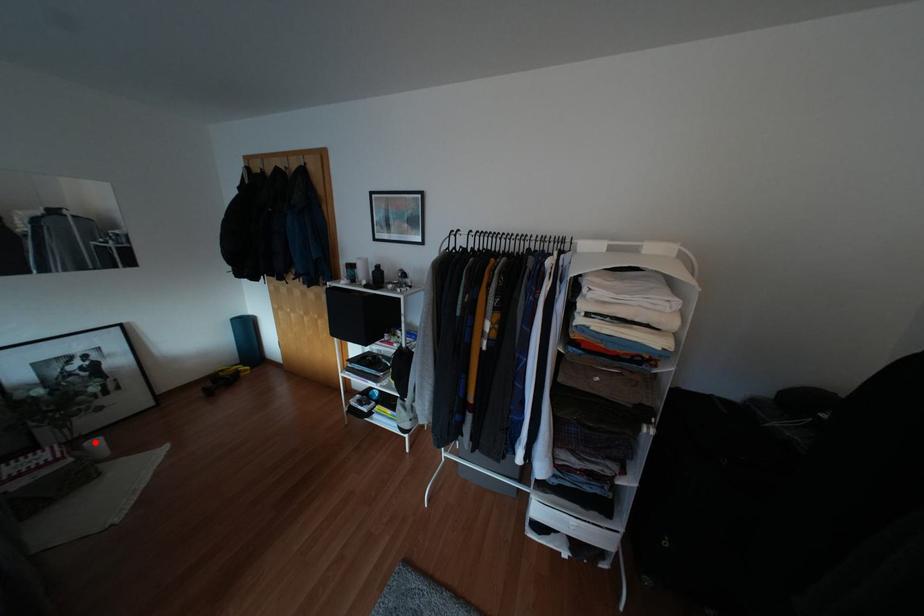
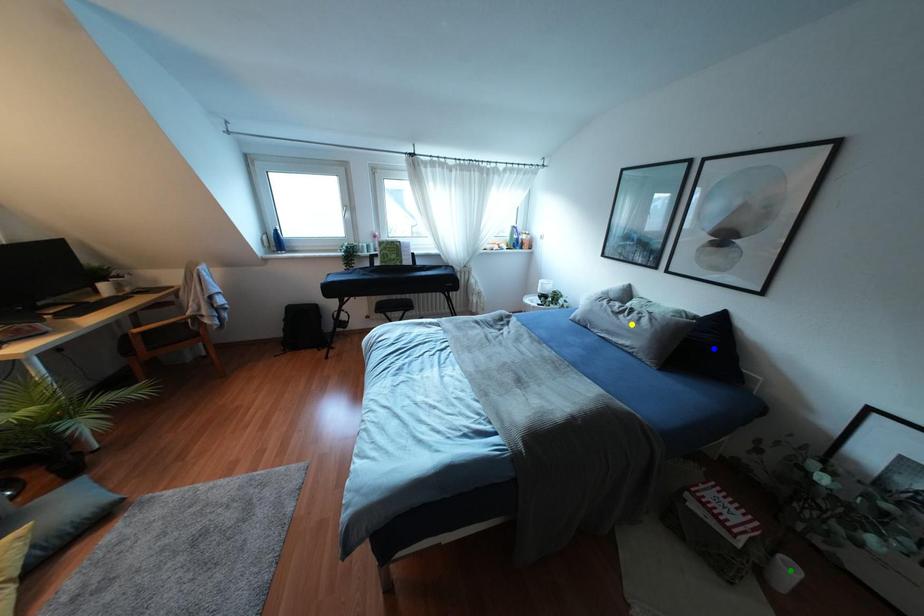
Question: I am providing you with two images of the same scene from different viewpoints. A red point is marked on the first image. You are given multiple points on the second image. In image 2, which mark is for the same physical point as the one in image 1?

Choices:
 (A) green point
 (B) blue point
 (C) yellow point

Answer: (A)